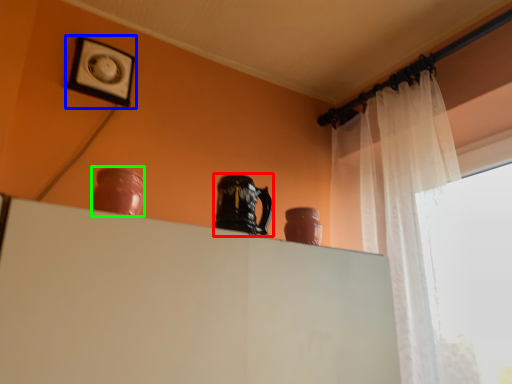
Question: Which is farther away from pottery (highlighted by a red box)? picture frame (highlighted by a blue box) or vase (highlighted by a green box)?

Choices:
 (A) picture frame
 (B) vase

Answer: (A)